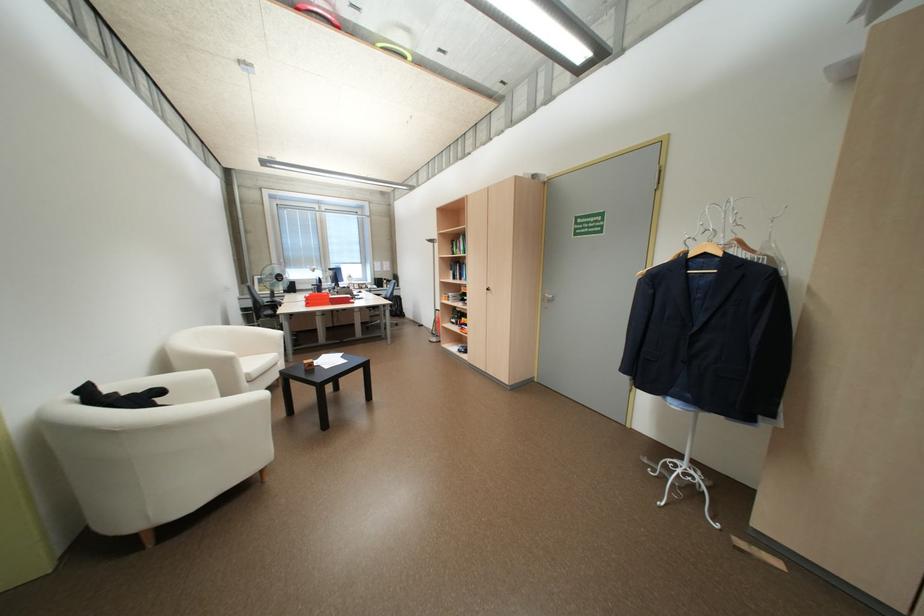
Where would you lift the small wooden block? Please return your answer as a coordinate pair (x, y).

(309, 363)